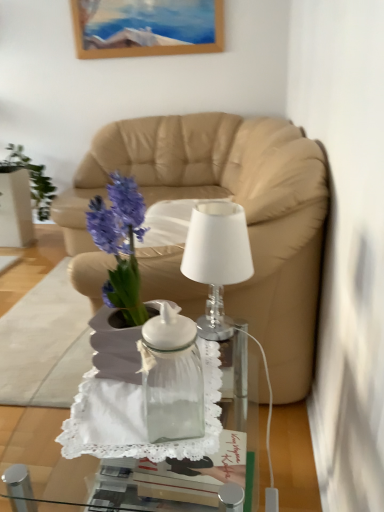
Question: From the image's perspective, is transparent glass jar at center on transparent glass vase at center?

Choices:
 (A) no
 (B) yes

Answer: (A)

Question: From a real-world perspective, is transparent glass jar at center physically below transparent glass vase at center?

Choices:
 (A) yes
 (B) no

Answer: (A)

Question: Does transparent glass jar at center have a lesser height compared to transparent glass vase at center?

Choices:
 (A) no
 (B) yes

Answer: (A)

Question: Is transparent glass jar at center turned away from transparent glass vase at center?

Choices:
 (A) no
 (B) yes

Answer: (A)

Question: Can we say transparent glass jar at center lies outside transparent glass vase at center?

Choices:
 (A) no
 (B) yes

Answer: (B)

Question: Is transparent glass jar at center to the left of transparent glass vase at center from the viewer's perspective?

Choices:
 (A) yes
 (B) no

Answer: (B)

Question: Is transparent glass jar at center further to camera compared to white glass lamp at center?

Choices:
 (A) yes
 (B) no

Answer: (B)

Question: Is the surface of transparent glass jar at center in direct contact with white glass lamp at center?

Choices:
 (A) yes
 (B) no

Answer: (B)

Question: From a real-world perspective, is transparent glass jar at center below white glass lamp at center?

Choices:
 (A) no
 (B) yes

Answer: (B)

Question: Is transparent glass jar at center at the left side of white glass lamp at center?

Choices:
 (A) no
 (B) yes

Answer: (B)

Question: Considering the relative sizes of transparent glass jar at center and white glass lamp at center in the image provided, is transparent glass jar at center shorter than white glass lamp at center?

Choices:
 (A) yes
 (B) no

Answer: (B)

Question: Is transparent glass jar at center facing towards white glass lamp at center?

Choices:
 (A) no
 (B) yes

Answer: (A)

Question: From the image's perspective, does transparent glass vase at center appear lower than beige leather couch at center?

Choices:
 (A) yes
 (B) no

Answer: (A)